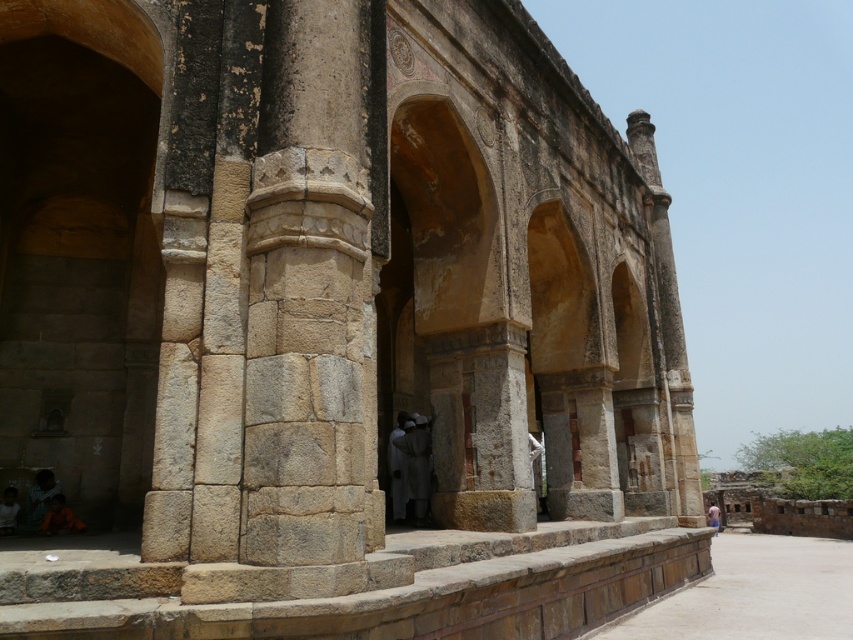
You are an architect examining the ancient stone structure. You notice a point labeled at coordinates [413,465]. Based on the scene description, what object is located at this point?

The point at coordinates [413,465] corresponds to the white stone statue at center.

You are standing in front of the ancient stone structure and see the dark gray stone person at lower left and the blue fabric person at center. Which object is located higher up in the image?

The dark gray stone person at lower left is positioned over the blue fabric person at center, so it is higher up in the image.

You are standing in front of the ancient stone structure and see the dark gray stone person at lower left and the blue fabric person at center. Which one is positioned more to the left side of the structure?

The dark gray stone person at lower left is positioned more to the left side of the structure than the blue fabric person at center.